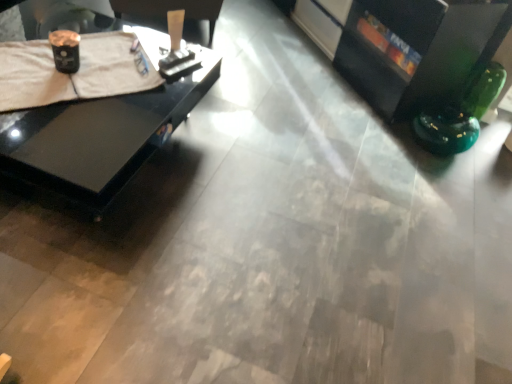
Question: Does black glossy entertainment center at upper right have a lesser height compared to black glossy table at left?

Choices:
 (A) yes
 (B) no

Answer: (B)

Question: Is black glossy entertainment center at upper right bigger than black glossy table at left?

Choices:
 (A) no
 (B) yes

Answer: (B)

Question: From a real-world perspective, is black glossy entertainment center at upper right located higher than black glossy table at left?

Choices:
 (A) yes
 (B) no

Answer: (A)

Question: Does black glossy entertainment center at upper right have a lesser width compared to black glossy table at left?

Choices:
 (A) no
 (B) yes

Answer: (B)

Question: Could black glossy table at left be considered to be inside black glossy entertainment center at upper right?

Choices:
 (A) yes
 (B) no

Answer: (B)

Question: Is black glossy entertainment center at upper right closer to camera compared to black glossy table at left?

Choices:
 (A) yes
 (B) no

Answer: (B)

Question: From a real-world perspective, is black glossy entertainment center at upper right over white cloth at upper left?

Choices:
 (A) no
 (B) yes

Answer: (B)

Question: Does black glossy entertainment center at upper right have a larger size compared to white cloth at upper left?

Choices:
 (A) no
 (B) yes

Answer: (B)

Question: Considering the relative sizes of black glossy entertainment center at upper right and white cloth at upper left in the image provided, is black glossy entertainment center at upper right smaller than white cloth at upper left?

Choices:
 (A) yes
 (B) no

Answer: (B)

Question: Is black glossy entertainment center at upper right oriented away from white cloth at upper left?

Choices:
 (A) no
 (B) yes

Answer: (A)

Question: Does black glossy entertainment center at upper right have a lesser width compared to white cloth at upper left?

Choices:
 (A) no
 (B) yes

Answer: (A)

Question: Could you tell me if black glossy entertainment center at upper right is facing white cloth at upper left?

Choices:
 (A) yes
 (B) no

Answer: (A)

Question: Is white cloth at upper left positioned far away from black glossy table at left?

Choices:
 (A) yes
 (B) no

Answer: (B)